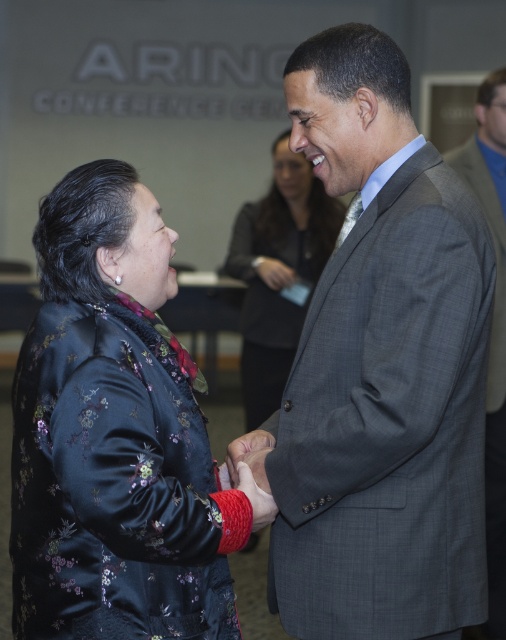
You are observing a professional meeting between two people. The scene includes a satin floral jacket at left and a gray plaid suit at center. Which of these two items is positioned farther to the left?

The satin floral jacket at left is positioned farther to the left than the gray plaid suit at center.

You are standing in front of the two people shaking hands. You need to place a small gift between them. Which point, point 1 at coordinates point (75, 589) or point 2 at coordinates point (493, 205), is closer to you so you can place the gift there?

Point 1 at coordinates point (75, 589) is closer to the viewer than point 2 at coordinates point (493, 205), so you should place the gift there.